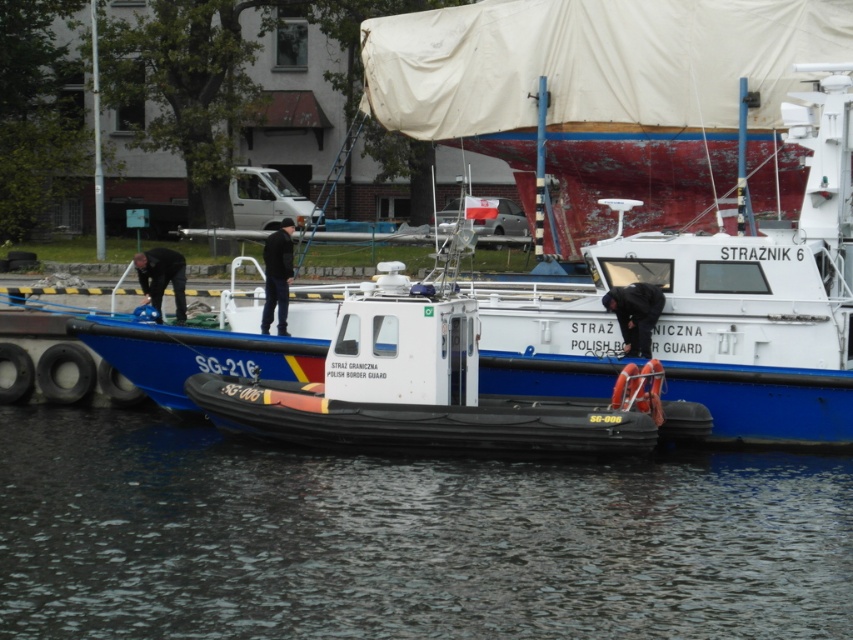
Is orange life vest at center bigger than matte blue helmet at left?

Indeed, orange life vest at center has a larger size compared to matte blue helmet at left.

Who is shorter, orange life vest at center or matte blue helmet at left?

With less height is matte blue helmet at left.

Is point (618, 308) positioned before point (178, 317)?

Yes.

Where is `orange life vest at center`? orange life vest at center is located at coordinates pyautogui.click(x=635, y=314).

Does black matte jacket at center have a greater height compared to matte blue helmet at left?

Yes, black matte jacket at center is taller than matte blue helmet at left.

Can you confirm if black matte jacket at center is shorter than matte blue helmet at left?

No, black matte jacket at center is not shorter than matte blue helmet at left.

What do you see at coordinates (277, 275) in the screenshot? I see `black matte jacket at center` at bounding box center [277, 275].

Locate an element on the screen. Image resolution: width=853 pixels, height=640 pixels. black matte jacket at center is located at coordinates (277, 275).

Does white rubber boat at center have a larger size compared to matte blue helmet at left?

Indeed, white rubber boat at center has a larger size compared to matte blue helmet at left.

Does white rubber boat at center have a greater height compared to matte blue helmet at left?

Yes, white rubber boat at center is taller than matte blue helmet at left.

Which is behind, point (590, 420) or point (183, 276)?

The point (183, 276) is more distant.

What are the coordinates of `white rubber boat at center` in the screenshot? It's located at point(413,390).